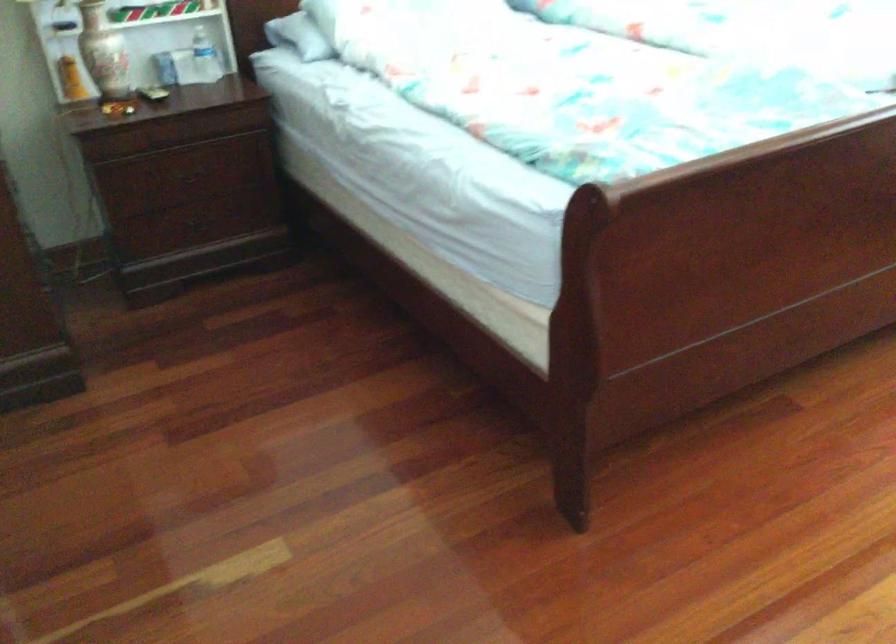
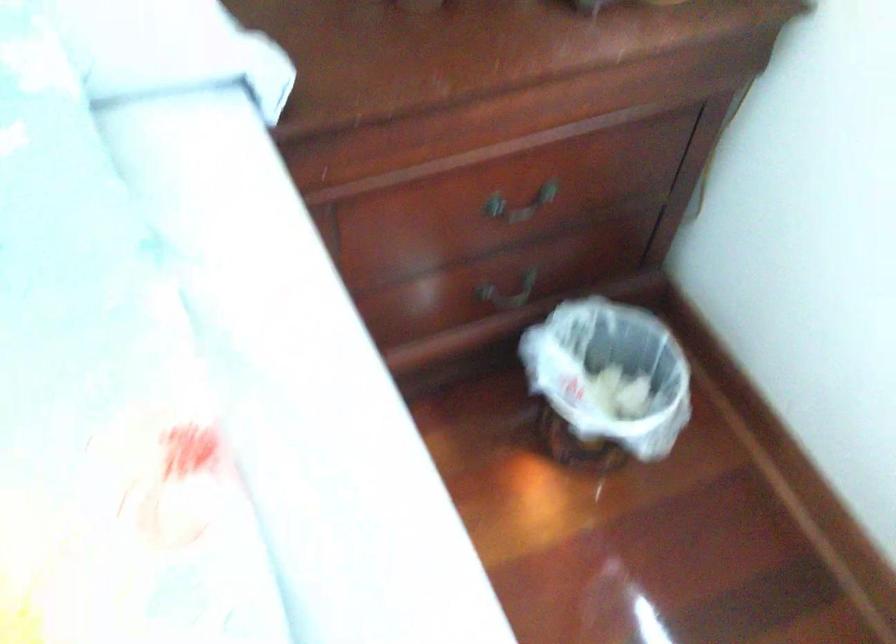
Which direction would the cameraman need to move to produce the second image?

The cameraman walked toward right, forward.